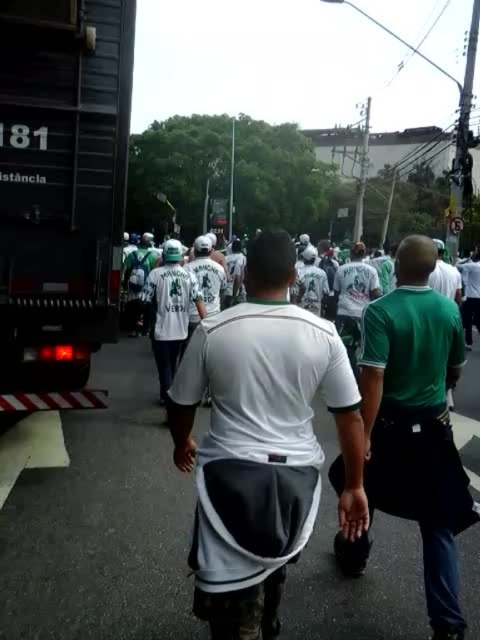
Question: Can you confirm if dark gray metal truck at left is thinner than green matte shirt at center?

Choices:
 (A) yes
 (B) no

Answer: (B)

Question: Among these points, which one is nearest to the camera?

Choices:
 (A) (41, 56)
 (B) (391, 396)

Answer: (B)

Question: Considering the relative positions of dark gray metal truck at left and green matte shirt at center in the image provided, where is dark gray metal truck at left located with respect to green matte shirt at center?

Choices:
 (A) below
 (B) above

Answer: (B)

Question: Estimate the real-world distances between objects in this image. Which object is farther from the green matte shirt at center?

Choices:
 (A) dark gray metal truck at left
 (B) white matte shirt at center

Answer: (A)

Question: Among these points, which one is nearest to the camera?

Choices:
 (A) (422, 296)
 (B) (33, 8)

Answer: (A)

Question: Is the position of dark gray metal truck at left more distant than that of white matte shirt at center?

Choices:
 (A) yes
 (B) no

Answer: (A)